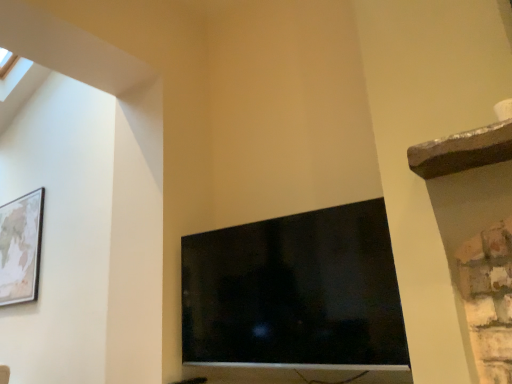
Question: Considering the positions of black glossy tv at center and wooden framed map at upper left in the image, is black glossy tv at center wider or thinner than wooden framed map at upper left?

Choices:
 (A) thin
 (B) wide

Answer: (B)

Question: Considering the positions of black glossy tv at center and wooden framed map at upper left in the image, is black glossy tv at center taller or shorter than wooden framed map at upper left?

Choices:
 (A) tall
 (B) short

Answer: (B)

Question: Is point (334, 249) closer or farther from the camera than point (13, 291)?

Choices:
 (A) closer
 (B) farther

Answer: (A)

Question: Based on their sizes in the image, would you say wooden framed map at upper left is bigger or smaller than black glossy tv at center?

Choices:
 (A) small
 (B) big

Answer: (A)

Question: Considering the positions of wooden framed map at upper left and black glossy tv at center in the image, is wooden framed map at upper left wider or thinner than black glossy tv at center?

Choices:
 (A) thin
 (B) wide

Answer: (A)

Question: Do you think wooden framed map at upper left is within black glossy tv at center, or outside of it?

Choices:
 (A) inside
 (B) outside

Answer: (B)

Question: Does point (33, 203) appear closer or farther from the camera than point (395, 367)?

Choices:
 (A) closer
 (B) farther

Answer: (B)